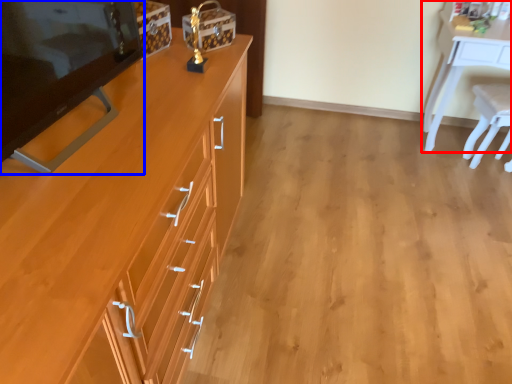
Question: Among these objects, which one is farthest to the camera, desk (highlighted by a red box) or changing table (highlighted by a blue box)?

Choices:
 (A) desk
 (B) changing table

Answer: (A)